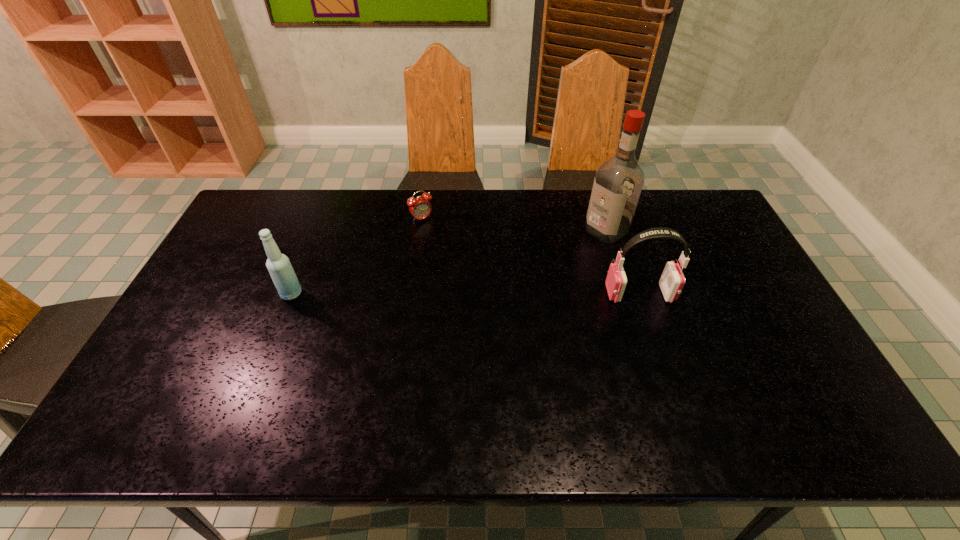
Identify the location of vacant area situated on the front-facing side of the tallest object. (578, 248).

Where is `vacant space situated 0.080m on the front-facing side of the tallest object`? Image resolution: width=960 pixels, height=540 pixels. vacant space situated 0.080m on the front-facing side of the tallest object is located at coordinates (575, 249).

Where is `free region located on the face of the shortest object`? This screenshot has height=540, width=960. free region located on the face of the shortest object is located at coordinates (445, 246).

This screenshot has height=540, width=960. I want to click on free space located 0.200m on the face of the shortest object, so click(456, 259).

This screenshot has height=540, width=960. In order to click on free space located on the face of the shortest object in this screenshot , I will do `click(443, 243)`.

At what (x,y) coordinates should I click in order to perform the action: click on liquor positioned at the far edge. Please return your answer as a coordinate pair (x, y). Image resolution: width=960 pixels, height=540 pixels. Looking at the image, I should click on (618, 182).

You are a GUI agent. You are given a task and a screenshot of the screen. Output one action in this format:
    pyautogui.click(x=<x>, y=<y>)
    Task: Click on the alarm clock located at the far edge
    Image resolution: width=960 pixels, height=540 pixels.
    Given the screenshot: What is the action you would take?
    pyautogui.click(x=420, y=208)

At what (x,y) coordinates should I click in order to perform the action: click on vacant space at the far edge. Please return your answer as a coordinate pair (x, y). Looking at the image, I should click on (528, 224).

This screenshot has height=540, width=960. In order to click on vacant area at the near edge in this screenshot , I will do `click(559, 382)`.

In the image, there is a desktop. Where is `free space at the right edge`? The height and width of the screenshot is (540, 960). free space at the right edge is located at coordinates (702, 259).